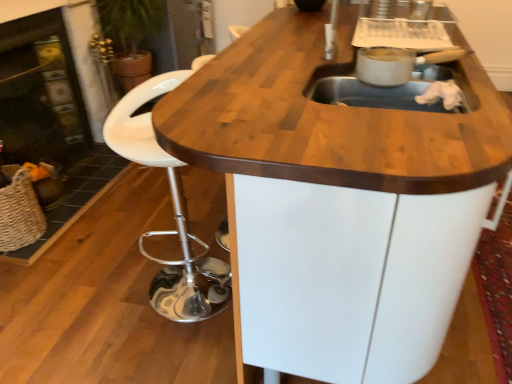
Question: Considering the relative sizes of black glass fireplace at left, placed as the first fireplace when sorted from right to left, and woven straw basket at lower left in the image provided, is black glass fireplace at left, placed as the first fireplace when sorted from right to left, bigger than woven straw basket at lower left?

Choices:
 (A) no
 (B) yes

Answer: (B)

Question: Can you confirm if black glass fireplace at left, placed as the first fireplace when sorted from right to left, is smaller than woven straw basket at lower left?

Choices:
 (A) yes
 (B) no

Answer: (B)

Question: Is black glass fireplace at left, positioned as the second fireplace in left-to-right order, to the right of woven straw basket at lower left from the viewer's perspective?

Choices:
 (A) yes
 (B) no

Answer: (B)

Question: Can you confirm if black glass fireplace at left, positioned as the second fireplace in left-to-right order, is taller than woven straw basket at lower left?

Choices:
 (A) no
 (B) yes

Answer: (B)

Question: Is black glass fireplace at left, positioned as the second fireplace in left-to-right order, positioned with its back to woven straw basket at lower left?

Choices:
 (A) no
 (B) yes

Answer: (A)

Question: Is point (46, 114) closer or farther from the camera than point (4, 84)?

Choices:
 (A) farther
 (B) closer

Answer: (A)

Question: From the image's perspective, is matte black fireplace at left, the second fireplace viewed from the right, above or below black glass fireplace at left, positioned as the second fireplace in left-to-right order?

Choices:
 (A) above
 (B) below

Answer: (B)

Question: In the image, is matte black fireplace at left, the 1th fireplace when ordered from left to right, positioned in front of or behind black glass fireplace at left, positioned as the second fireplace in left-to-right order?

Choices:
 (A) behind
 (B) front

Answer: (A)

Question: Considering the positions of matte black fireplace at left, the 1th fireplace when ordered from left to right, and black glass fireplace at left, placed as the first fireplace when sorted from right to left, in the image, is matte black fireplace at left, the 1th fireplace when ordered from left to right, taller or shorter than black glass fireplace at left, placed as the first fireplace when sorted from right to left,?

Choices:
 (A) tall
 (B) short

Answer: (B)

Question: Considering the relative positions of matte black fireplace at left, the second fireplace viewed from the right, and white plastic stool at lower left in the image provided, is matte black fireplace at left, the second fireplace viewed from the right, to the left or to the right of white plastic stool at lower left?

Choices:
 (A) left
 (B) right

Answer: (A)

Question: In terms of height, does matte black fireplace at left, the second fireplace viewed from the right, look taller or shorter compared to white plastic stool at lower left?

Choices:
 (A) short
 (B) tall

Answer: (B)

Question: Does point pos(1,92) appear closer or farther from the camera than point pos(175,168)?

Choices:
 (A) closer
 (B) farther

Answer: (B)

Question: Is matte black fireplace at left, the 1th fireplace when ordered from left to right, wider or thinner than white plastic stool at lower left?

Choices:
 (A) thin
 (B) wide

Answer: (A)

Question: Visually, is woven straw basket at lower left positioned to the left or to the right of white plastic stool at lower left?

Choices:
 (A) left
 (B) right

Answer: (A)

Question: Is woven straw basket at lower left bigger or smaller than white plastic stool at lower left?

Choices:
 (A) big
 (B) small

Answer: (B)